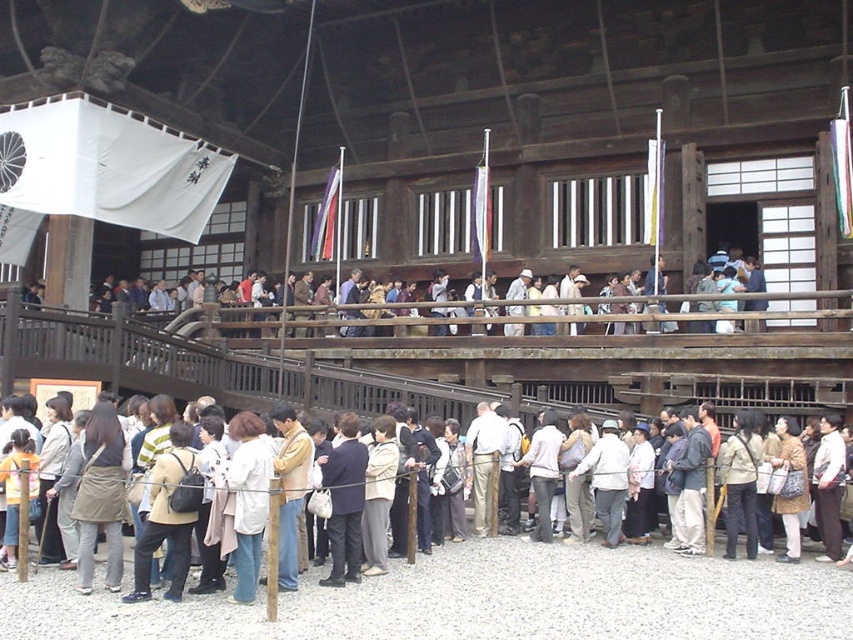
Question: Which point is closer to the camera?

Choices:
 (A) (320, 497)
 (B) (729, 323)

Answer: (A)

Question: Among these points, which one is nearest to the camera?

Choices:
 (A) (450, 307)
 (B) (624, 547)

Answer: (B)

Question: Observing the image, what is the correct spatial positioning of light brown wooden railing at upper center in reference to matte beige coat at center?

Choices:
 (A) left
 (B) right

Answer: (A)

Question: Considering the relative positions of light brown wooden railing at upper center and matte beige coat at center in the image provided, where is light brown wooden railing at upper center located with respect to matte beige coat at center?

Choices:
 (A) below
 (B) above

Answer: (B)

Question: Considering the relative positions of light brown wooden railing at upper center and matte beige coat at center in the image provided, where is light brown wooden railing at upper center located with respect to matte beige coat at center?

Choices:
 (A) above
 (B) below

Answer: (A)

Question: Which point is closer to the camera taking this photo?

Choices:
 (A) (689, 300)
 (B) (450, 547)

Answer: (B)